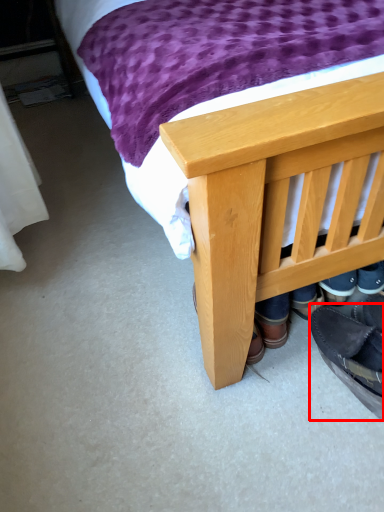
Question: Considering the relative positions of footwear (annotated by the red box) and bed in the image provided, where is footwear (annotated by the red box) located with respect to the staircase?

Choices:
 (A) left
 (B) right

Answer: (A)